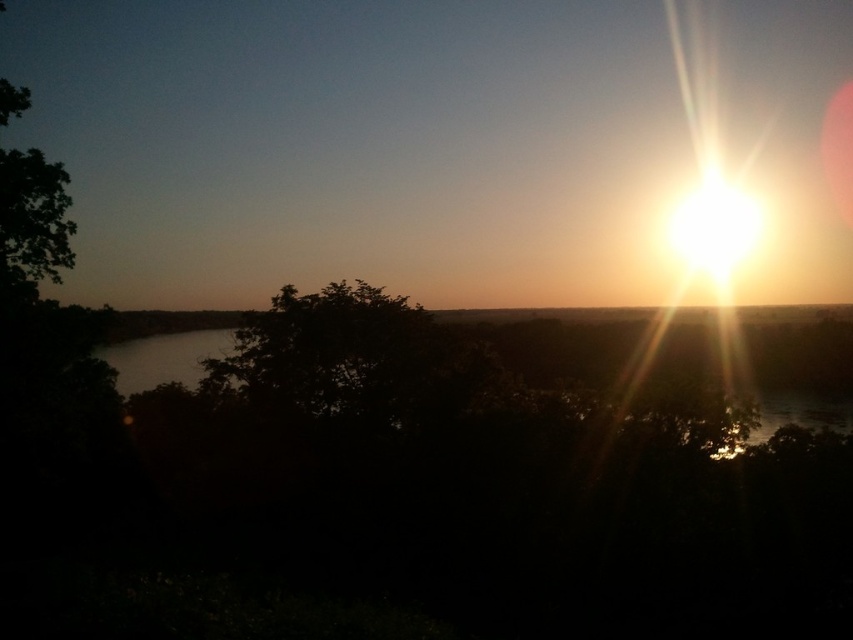
Is dark green leafy tree at center further to camera compared to green leafy tree at upper left?

Yes, dark green leafy tree at center is behind green leafy tree at upper left.

Can you confirm if dark green leafy tree at center is thinner than green leafy tree at upper left?

Incorrect, dark green leafy tree at center's width is not less than green leafy tree at upper left's.

Which is in front, point (271, 326) or point (61, 168)?

Point (61, 168)

Locate an element on the screen. dark green leafy tree at center is located at coordinates (334, 355).